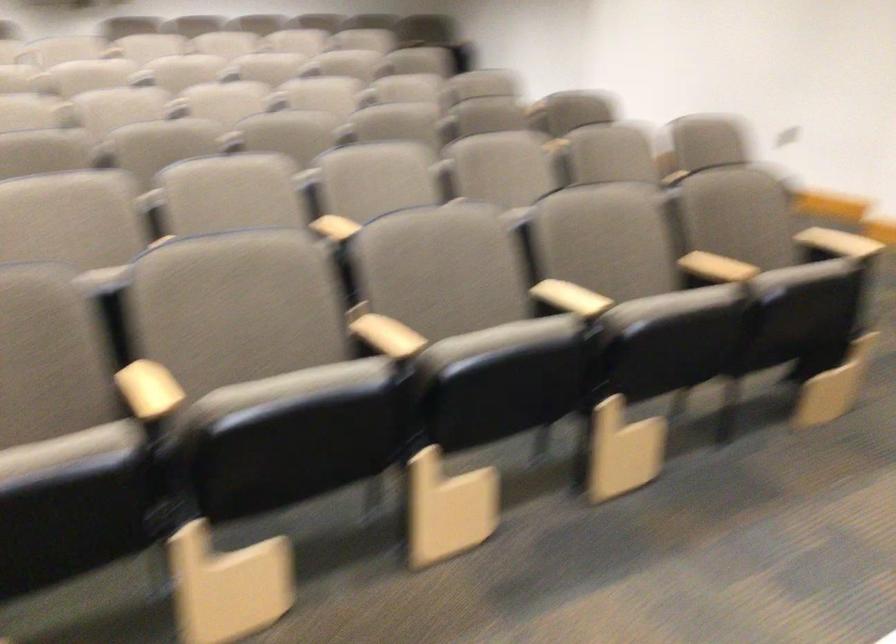
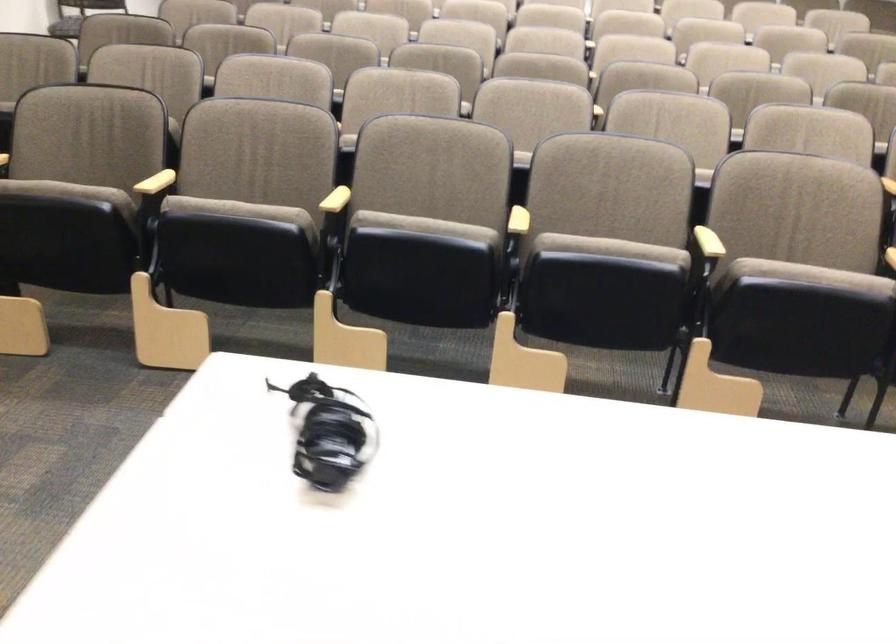
Where in the second image is the point corresponding to point (567, 299) from the first image?

(709, 242)